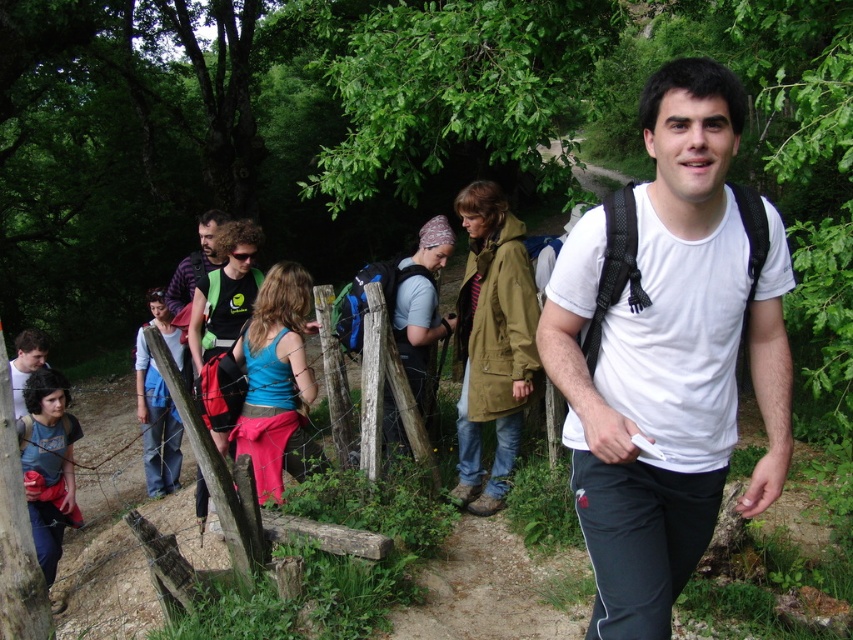
You are a photographer standing at the edge of the forest. You want to take a photo of the matte blue shirt at lower left and the denim skirt at center so that they appear close together in the frame. Given their current distance, will they look close in the photo?

The matte blue shirt at lower left is 3.66 feet away from the denim skirt at center. Since they are only about 3.66 feet apart, they will appear close together in the photo.